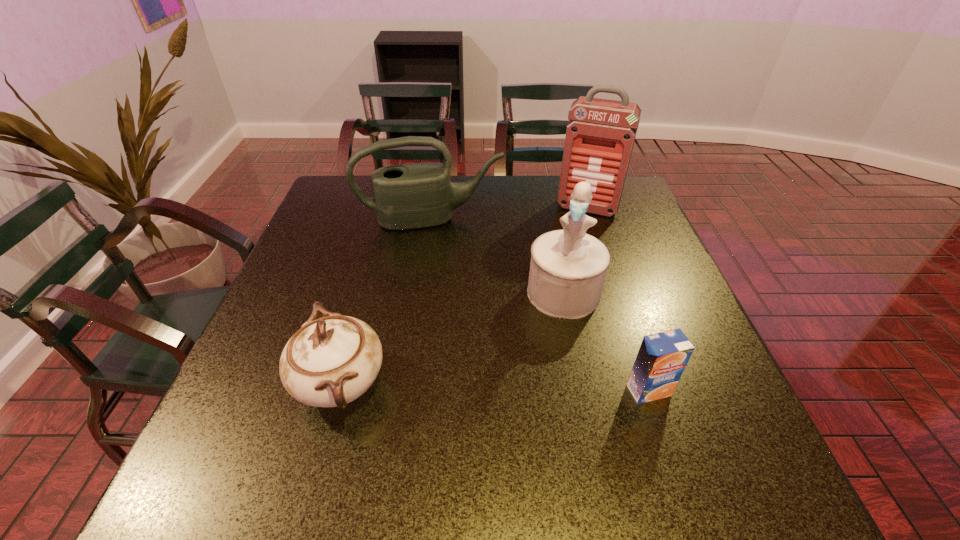
What are the coordinates of `free space on the desktop that is between the fourth tallest object and the orange_juice and is positioned on the spout of the third shortest object` in the screenshot? It's located at (463, 387).

You are a GUI agent. You are given a task and a screenshot of the screen. Output one action in this format:
    pyautogui.click(x=<x>, y=<y>)
    Task: Click on the free space on the desktop that is between the second shortest object and the orange_juice and is positioned on the front-facing side of the tallest object
    
    Given the screenshot: What is the action you would take?
    pyautogui.click(x=531, y=388)

Locate an element on the screen. vacant space on the desktop that is between the chinaware and the orange_juice and is positioned at the beak of the figurine is located at coordinates (534, 388).